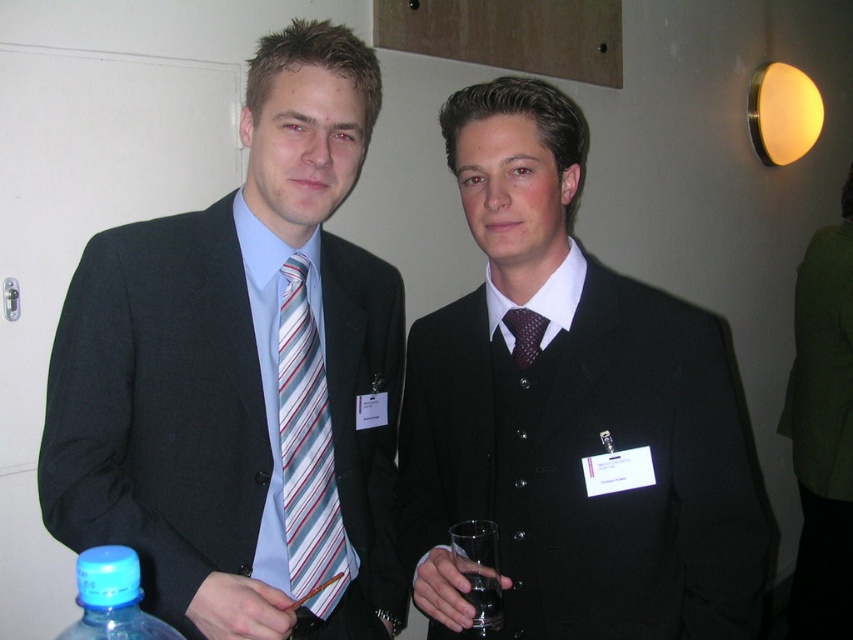
Question: Considering the real-world distances, which object is farthest from the matte black suit at center?

Choices:
 (A) polka dot silk tie at center
 (B) transparent glass at center

Answer: (B)

Question: Which object appears closest to the camera in this image?

Choices:
 (A) polka dot silk tie at center
 (B) transparent glass at center
 (C) matte black suit at center

Answer: (C)

Question: Can you confirm if matte black suit at center is smaller than polka dot silk tie at center?

Choices:
 (A) no
 (B) yes

Answer: (A)

Question: Does transparent glass at center appear on the right side of polka dot silk tie at center?

Choices:
 (A) yes
 (B) no

Answer: (B)

Question: Is matte black suit at left bigger than matte black suit at center?

Choices:
 (A) no
 (B) yes

Answer: (B)

Question: Which point is farther to the camera?

Choices:
 (A) 306,621
 (B) 486,609

Answer: (A)